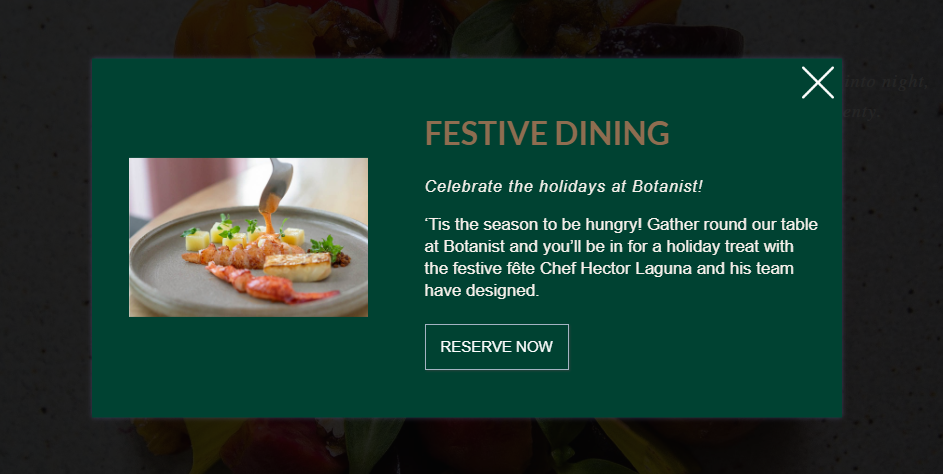
Locate an element on the screen. pewter plate is located at coordinates (169, 282).